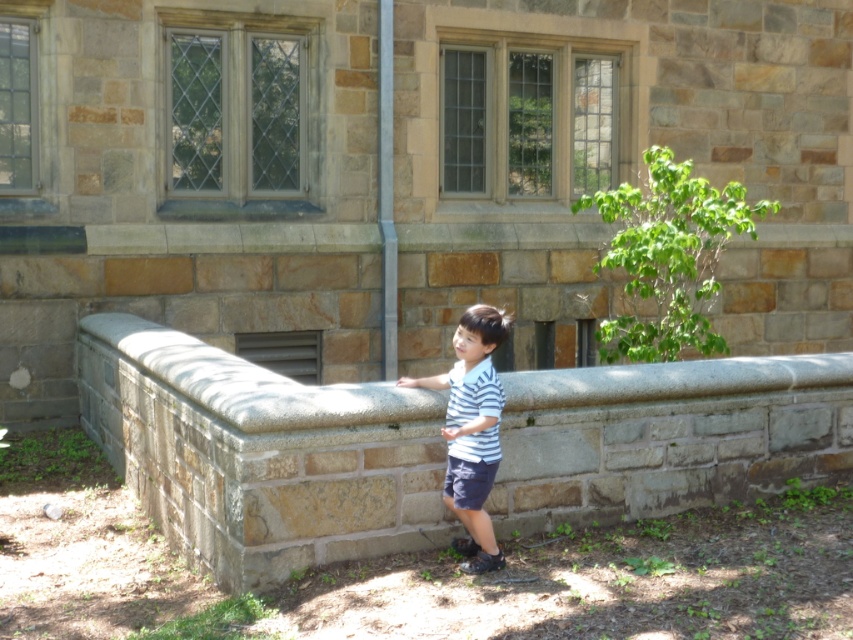
Question: Is gray stone ledge at center to the left of striped cotton shirt at center from the viewer's perspective?

Choices:
 (A) no
 (B) yes

Answer: (B)

Question: Among these points, which one is farthest from the camera?

Choices:
 (A) (456, 406)
 (B) (233, 440)

Answer: (A)

Question: Which object appears closest to the camera in this image?

Choices:
 (A) striped cotton shirt at center
 (B) gray stone ledge at center

Answer: (A)

Question: Can you confirm if gray stone ledge at center is wider than striped cotton shirt at center?

Choices:
 (A) no
 (B) yes

Answer: (B)

Question: Does gray stone ledge at center appear under striped cotton shirt at center?

Choices:
 (A) yes
 (B) no

Answer: (A)

Question: Which of the following is the farthest from the observer?

Choices:
 (A) (456, 442)
 (B) (299, 390)

Answer: (B)